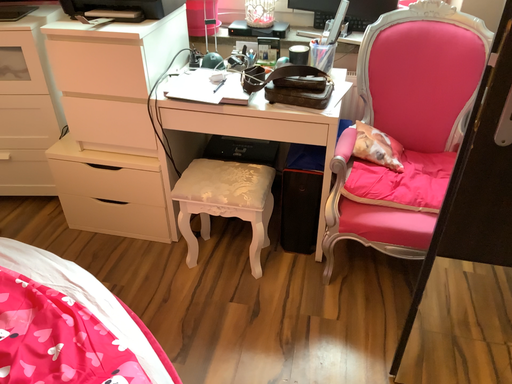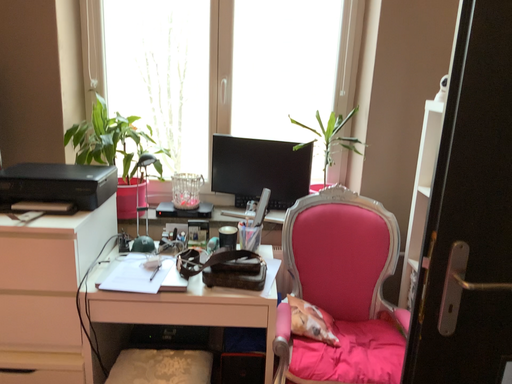
Question: Which way did the camera rotate in the video?

Choices:
 (A) rotated left
 (B) rotated right

Answer: (B)